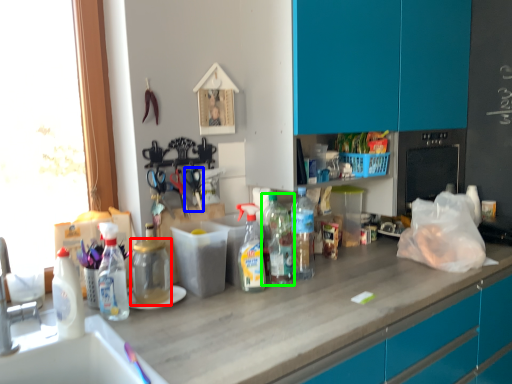
Question: Based on their relative distances, which object is farther from bottle (highlighted by a red box)? Choose from scissors (highlighted by a blue box) and bottle (highlighted by a green box).

Choices:
 (A) scissors
 (B) bottle

Answer: (B)